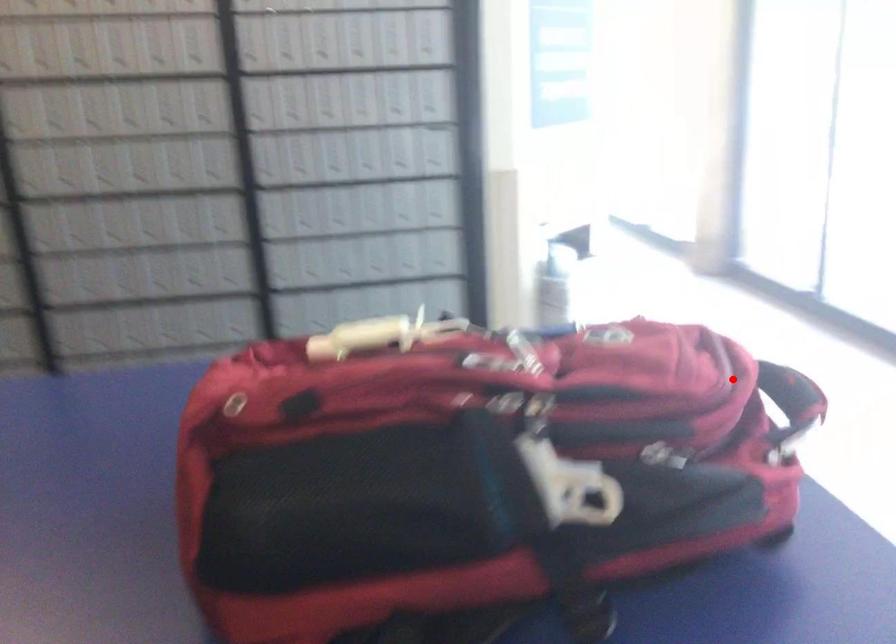
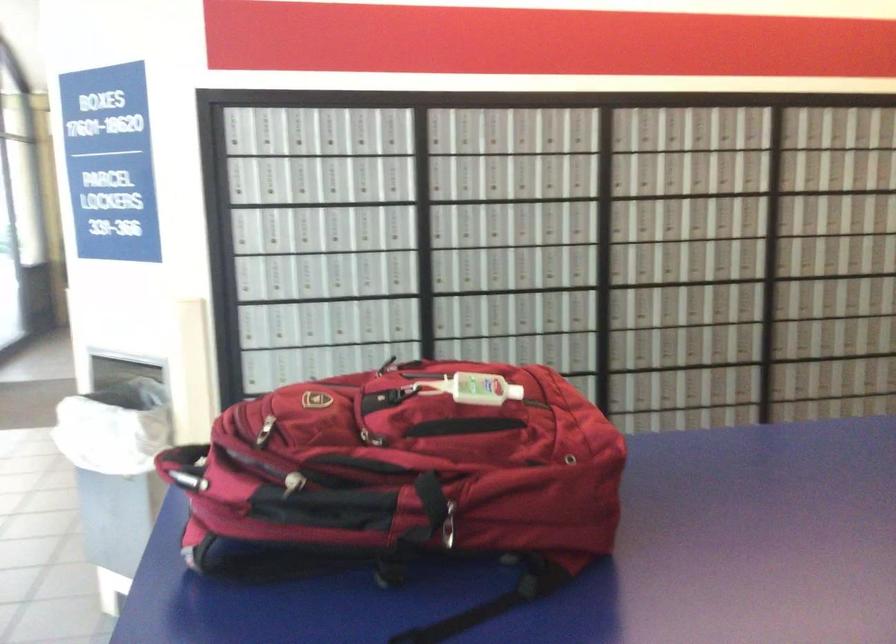
Question: I am providing you with two images of the same scene from different viewpoints. Image1 has a red point marked. In image2, the corresponding 3D location appears at what relative position? Reply with the corresponding letter.

Choices:
 (A) Closer
 (B) Farther

Answer: (B)